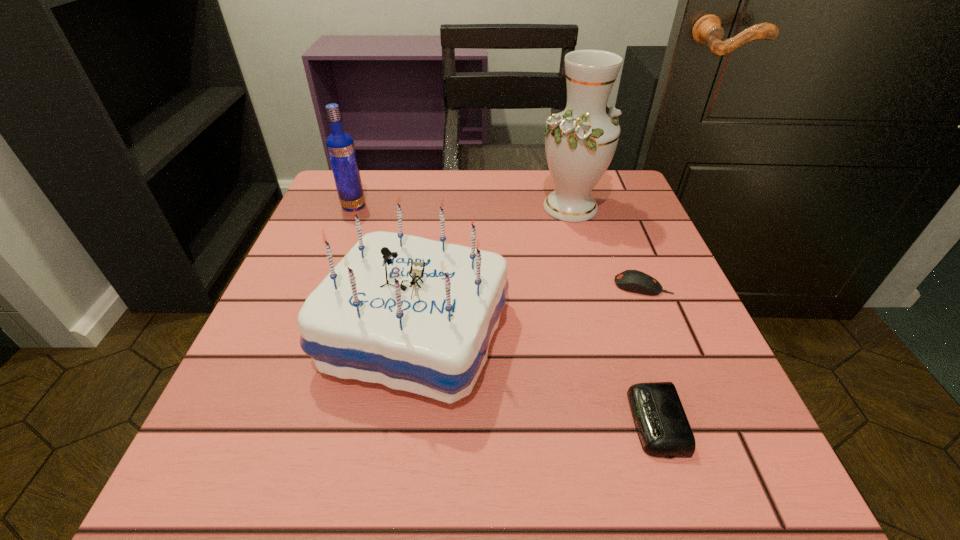
Where is `free space between the computer mouse and the alarm clock`? This screenshot has height=540, width=960. free space between the computer mouse and the alarm clock is located at coordinates (649, 354).

Locate an element on the screen. The image size is (960, 540). vacant area that lies between the computer mouse and the tallest object is located at coordinates (607, 246).

Where is `unoccupied area between the leftmost object and the vase`? unoccupied area between the leftmost object and the vase is located at coordinates (462, 207).

This screenshot has width=960, height=540. In order to click on free area in between the computer mouse and the vodka in this screenshot , I will do `click(498, 246)`.

What are the coordinates of `blank region between the birthday cake and the alarm clock` in the screenshot? It's located at (536, 379).

Identify the location of vacant region between the vodka and the computer mouse. (498, 246).

Locate an element on the screen. Image resolution: width=960 pixels, height=540 pixels. free area in between the second object from left to right and the computer mouse is located at coordinates (529, 311).

Find the location of a particular element. Image resolution: width=960 pixels, height=540 pixels. the third closest object to the alarm clock is located at coordinates (580, 142).

Locate an element on the screen. object that stands as the closest to the leftmost object is located at coordinates (414, 314).

You are a GUI agent. You are given a task and a screenshot of the screen. Output one action in this format:
    pyautogui.click(x=<x>, y=<y>)
    Task: Click on the vacant area in the image that satisfies the following two spatial constraints: 1. on the front side of the computer mouse; 2. on the display of the alarm clock
    The width and height of the screenshot is (960, 540).
    Given the screenshot: What is the action you would take?
    pyautogui.click(x=696, y=421)